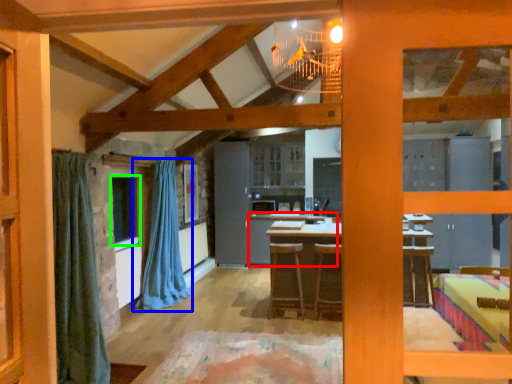
Question: Considering the real-world distances, which object is farthest from table (highlighted by a red box)? curtain (highlighted by a blue box) or window (highlighted by a green box)?

Choices:
 (A) curtain
 (B) window

Answer: (B)